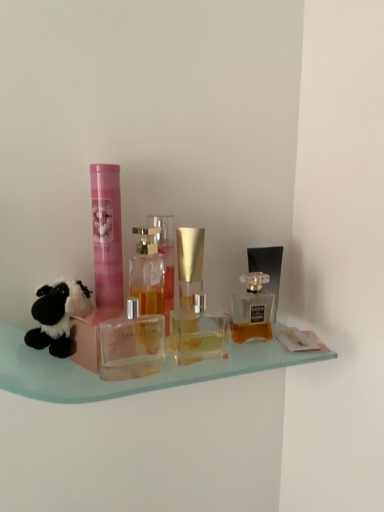
Question: Is matte glass perfume bottle at center, which ranks as the first bottle in right-to-left order, inside or outside of black plush toy at left?

Choices:
 (A) outside
 (B) inside

Answer: (A)

Question: From a real-world perspective, is matte glass perfume bottle at center, which ranks as the first bottle in right-to-left order, positioned above or below black plush toy at left?

Choices:
 (A) below
 (B) above

Answer: (A)

Question: Estimate the real-world distances between objects in this image. Which object is closer to the pink matte tube at center, which is the 2th toiletry from back to front?

Choices:
 (A) black plush toy at left
 (B) matte black perfume at right, which is counted as the 2th toiletry, starting from the left
 (C) clear glass perfume bottle at center, positioned as the second bottle in left-to-right order
 (D) matte glass perfume bottle at center, positioned as the 4th bottle in left-to-right order
 (E) clear glass perfume bottle at center, positioned as the fourth bottle in right-to-left order

Answer: (E)

Question: Considering the real-world distances, which object is closest to the black plush toy at left?

Choices:
 (A) clear glass perfume bottle at center, positioned as the fourth bottle in right-to-left order
 (B) matte glass perfume bottle at center, positioned as the 4th bottle in left-to-right order
 (C) matte black perfume at right, the 2th toiletry positioned from the front
 (D) pink matte tube at center, which is the 2th toiletry from back to front
 (E) transparent glass perfume bottle at center, which is counted as the 2th bottle, starting from the right

Answer: (D)